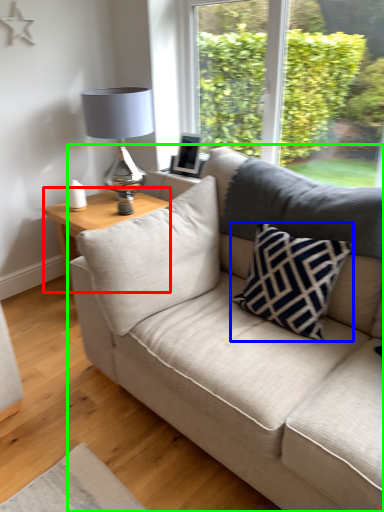
Question: Considering the real-world distances, which object is closest to table (highlighted by a red box)? pillow (highlighted by a blue box) or studio couch (highlighted by a green box).

Choices:
 (A) pillow
 (B) studio couch

Answer: (B)